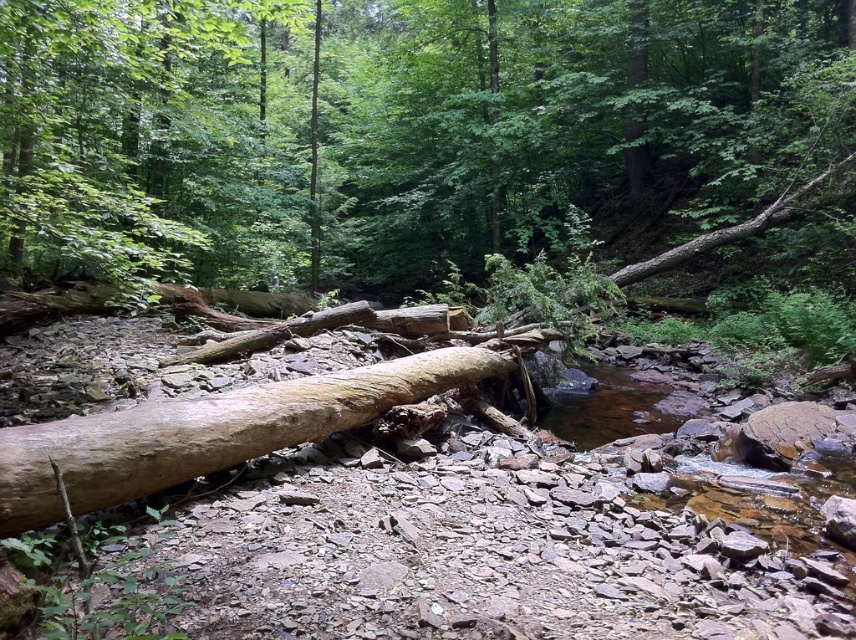
Is brown rough log at center below light brown wood log at center?

No.

Can you confirm if brown rough log at center is taller than light brown wood log at center?

Correct, brown rough log at center is much taller as light brown wood log at center.

Which is behind, point (302, 70) or point (257, 406)?

Positioned behind is point (302, 70).

Locate an element on the screen. The image size is (856, 640). brown rough log at center is located at coordinates (397, 129).